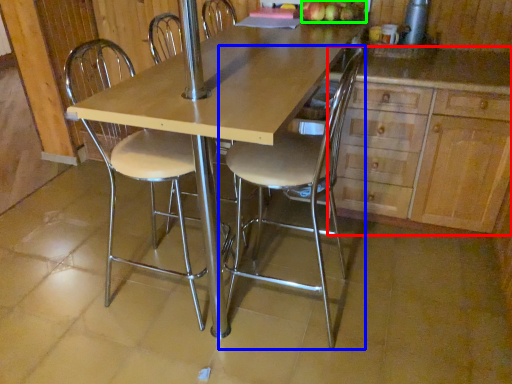
Question: Estimate the real-world distances between objects in this image. Which object is farther from cabinetry (highlighted by a red box), chair (highlighted by a blue box) or apple (highlighted by a green box)?

Choices:
 (A) chair
 (B) apple

Answer: (B)